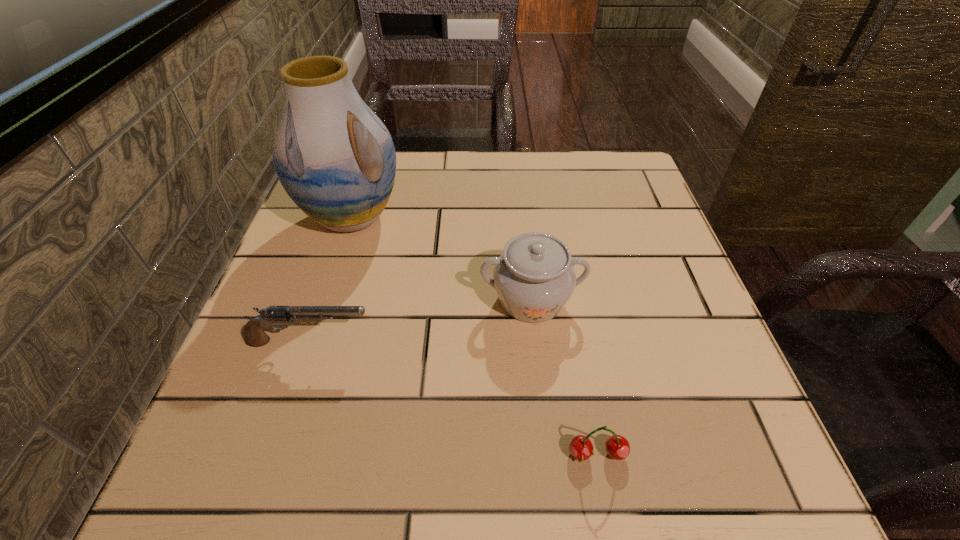
At what (x,y) coordinates should I click in order to perform the action: click on vacant point located between the third farthest object and the nearest object. Please return your answer as a coordinate pair (x, y). The width and height of the screenshot is (960, 540). Looking at the image, I should click on 453,397.

The width and height of the screenshot is (960, 540). Find the location of `empty space between the second farthest object and the cherry`. empty space between the second farthest object and the cherry is located at coordinates (564, 376).

Find the location of a particular element. The height and width of the screenshot is (540, 960). unoccupied position between the nearest object and the second tallest object is located at coordinates (564, 376).

In order to click on free space between the gun and the farthest object in this screenshot , I will do `click(330, 279)`.

Where is `empty space between the chinaware and the second nearest object`? Image resolution: width=960 pixels, height=540 pixels. empty space between the chinaware and the second nearest object is located at coordinates (420, 321).

This screenshot has width=960, height=540. Identify the location of empty space that is in between the chinaware and the vase. (442, 258).

Image resolution: width=960 pixels, height=540 pixels. What are the coordinates of `blank region between the gun and the tallest object` in the screenshot? It's located at (330, 279).

The height and width of the screenshot is (540, 960). I want to click on vacant area that lies between the second farthest object and the nearest object, so click(x=564, y=376).

At what (x,y) coordinates should I click in order to perform the action: click on empty space between the farthest object and the nearest object. Please return your answer as a coordinate pair (x, y). The image size is (960, 540). Looking at the image, I should click on (x=474, y=335).

Find the location of a particular element. The height and width of the screenshot is (540, 960). empty space between the tallest object and the gun is located at coordinates (330, 279).